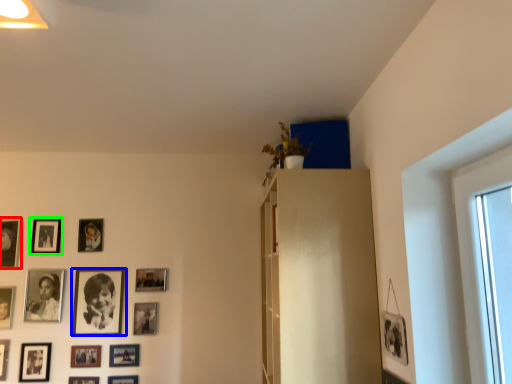
Question: Which object is positioned farthest from picture frame (highlighted by a red box)? Select from picture frame (highlighted by a blue box) and picture frame (highlighted by a green box).

Choices:
 (A) picture frame
 (B) picture frame

Answer: (A)